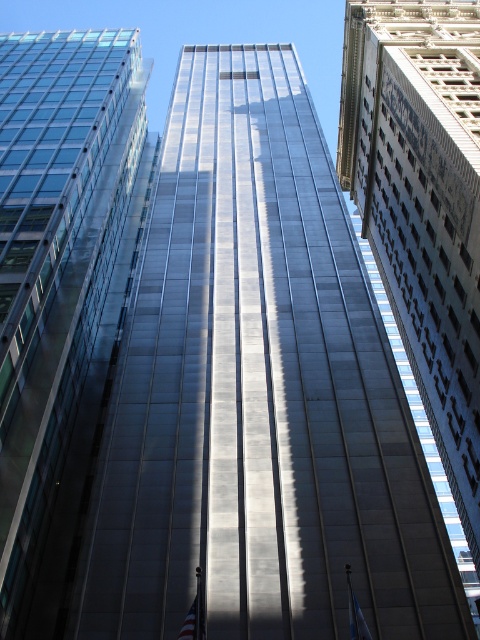
What is located at the coordinates point (194, 616) in the image?

The american flag at lower center is located at point (194, 616).

You are standing at the point marked as point (189,625) and want to take a photo of the modern skyscraper dominating the center of the frame. Considering your current position, will the modern skyscraper dominating the center of the frame be fully visible in your camera frame?

The point (189,625) is 83.88 feet away from the viewer. Since the modern skyscraper is the central focus and the distance allows for capturing its full structure, the modern skyscraper dominating the center of the frame will be fully visible in the camera frame.